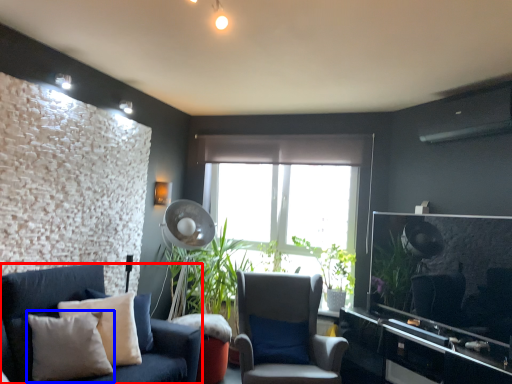
Question: Among these objects, which one is farthest to the camera, studio couch (highlighted by a red box) or pillow (highlighted by a blue box)?

Choices:
 (A) studio couch
 (B) pillow

Answer: (A)